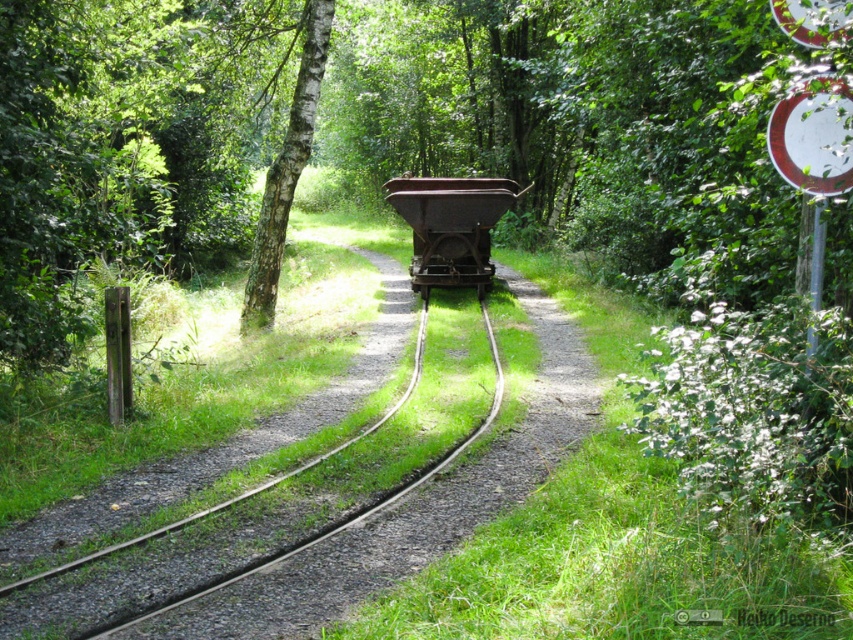
Is rusty metal train cart at center above white smooth tree at center?

Actually, rusty metal train cart at center is below white smooth tree at center.

Between rusty metal train cart at center and white smooth tree at center, which one is positioned lower?

rusty metal train cart at center is below.

The image size is (853, 640). Describe the element at coordinates (410, 506) in the screenshot. I see `rusty metal train cart at center` at that location.

Find the location of a particular element. The height and width of the screenshot is (640, 853). rusty metal train cart at center is located at coordinates (410, 506).

Which is above, rusty metal cart at center or white smooth tree at center?

white smooth tree at center is above.

Is rusty metal cart at center below white smooth tree at center?

Yes.

Describe the element at coordinates (451, 227) in the screenshot. I see `rusty metal cart at center` at that location.

What are the coordinates of `rusty metal cart at center` in the screenshot? It's located at (451, 227).

This screenshot has height=640, width=853. Describe the element at coordinates (410, 506) in the screenshot. I see `rusty metal train cart at center` at that location.

Which is more to the left, rusty metal train cart at center or rusty metal cart at center?

rusty metal cart at center is more to the left.

Who is more distant from viewer, (224, 536) or (491, 200)?

The point (491, 200) is more distant.

I want to click on rusty metal train cart at center, so click(410, 506).